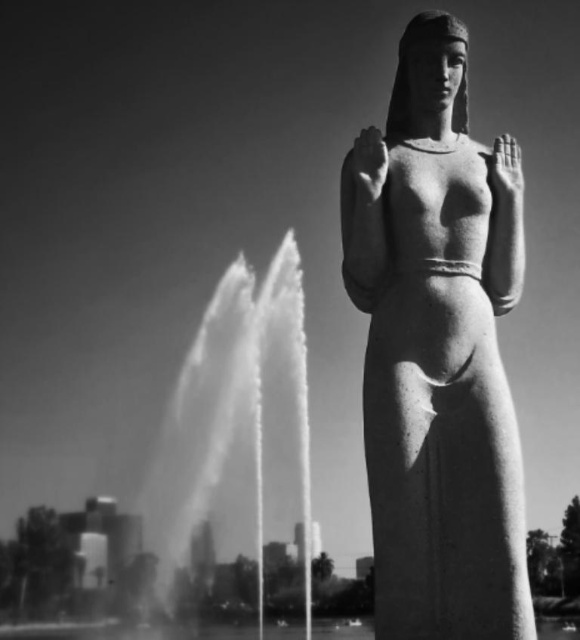
Measure the distance between granite statue at center and white matte hand at upper center.

The distance of granite statue at center from white matte hand at upper center is 9.23 feet.

Does point (505, 385) come farther from viewer compared to point (519, 161)?

No, it is in front of (519, 161).

Is point (392, 339) in front of point (520, 180)?

Yes, point (392, 339) is closer to viewer.

The width and height of the screenshot is (580, 640). I want to click on granite statue at center, so click(x=438, y=358).

Between point (324, 628) and point (368, 163), which one is positioned behind?

The point (324, 628) is more distant.

Does clear water at center appear on the left side of smooth stone hand at upper center?

Indeed, clear water at center is positioned on the left side of smooth stone hand at upper center.

Measure the distance between point (x=85, y=628) and camera.

Point (x=85, y=628) is 405.49 feet away from camera.

This screenshot has height=640, width=580. Identify the location of clear water at center. (125, 632).

Is granite statue at center taller than clear water at center?

No.

Does granite statue at center appear over clear water at center?

Yes.

Image resolution: width=580 pixels, height=640 pixels. I want to click on granite statue at center, so click(438, 358).